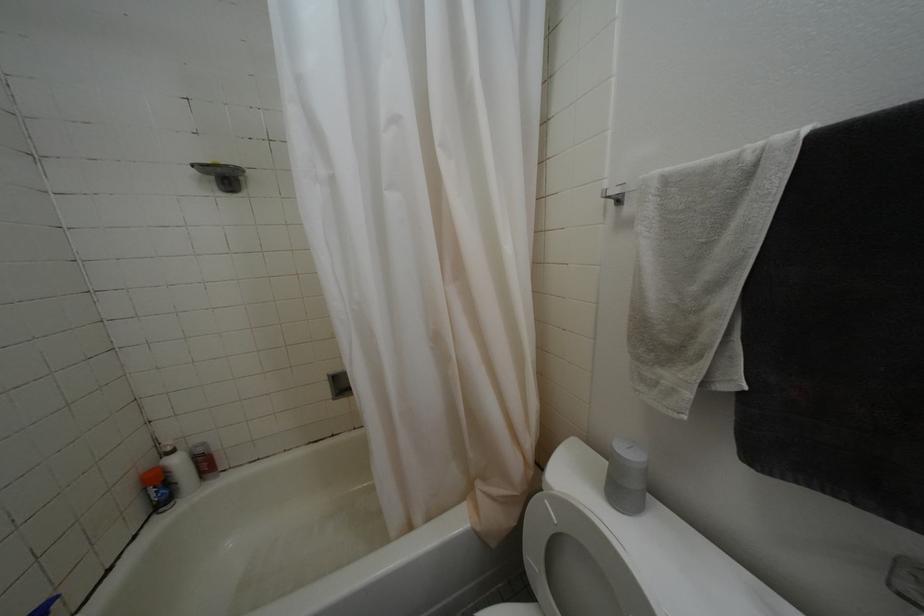
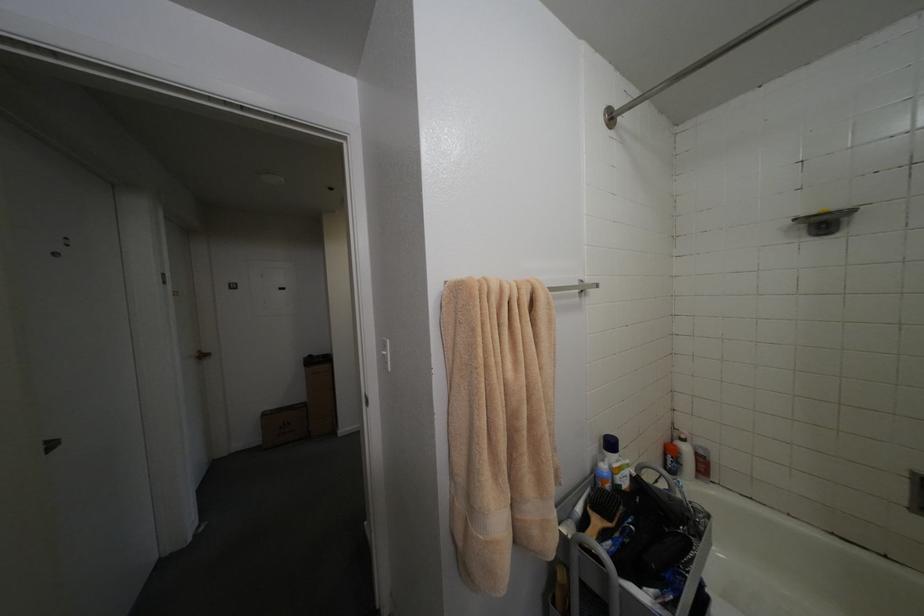
Question: The first image is from the beginning of the video and the second image is from the end. How did the camera likely rotate when shooting the video?

Choices:
 (A) Left
 (B) Right
 (C) Up
 (D) Down

Answer: (A)